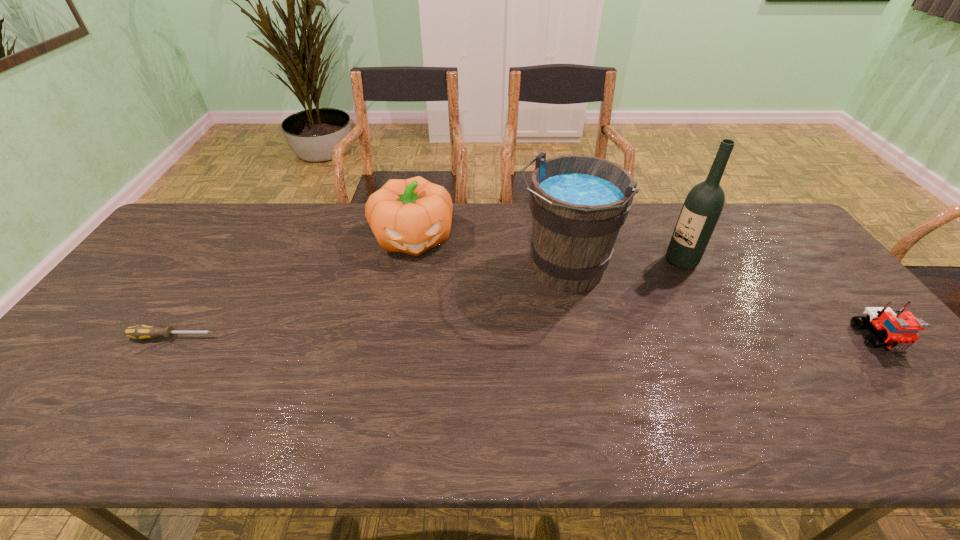
This screenshot has height=540, width=960. I want to click on wine bucket present at the far edge, so click(x=579, y=203).

Where is `pumpkin that is at the far edge`? The height and width of the screenshot is (540, 960). pumpkin that is at the far edge is located at coordinates (412, 215).

The image size is (960, 540). I want to click on object present at the left edge, so click(140, 332).

You are a GUI agent. You are given a task and a screenshot of the screen. Output one action in this format:
    pyautogui.click(x=<x>, y=<y>)
    Task: Click on the object at the right edge
    The image size is (960, 540).
    Given the screenshot: What is the action you would take?
    pyautogui.click(x=898, y=330)

Where is `vacant space at the far edge of the desktop`? vacant space at the far edge of the desktop is located at coordinates 272,241.

You are a GUI agent. You are given a task and a screenshot of the screen. Output one action in this format:
    pyautogui.click(x=<x>, y=<y>)
    Task: Click on the free space at the near edge of the desktop
    
    Given the screenshot: What is the action you would take?
    pyautogui.click(x=808, y=385)

What are the coordinates of `vacant space at the left edge of the desktop` in the screenshot? It's located at (118, 300).

In the image, there is a desktop. Identify the location of vacant space at the right edge. Image resolution: width=960 pixels, height=540 pixels. (796, 249).

Image resolution: width=960 pixels, height=540 pixels. I want to click on vacant space at the far right corner of the desktop, so click(765, 205).

At what (x,y) coordinates should I click in order to perform the action: click on vacant space in between the fourth tallest object and the fourth object from left to right. Please return your answer as a coordinate pair (x, y). This screenshot has width=960, height=540. Looking at the image, I should click on (780, 300).